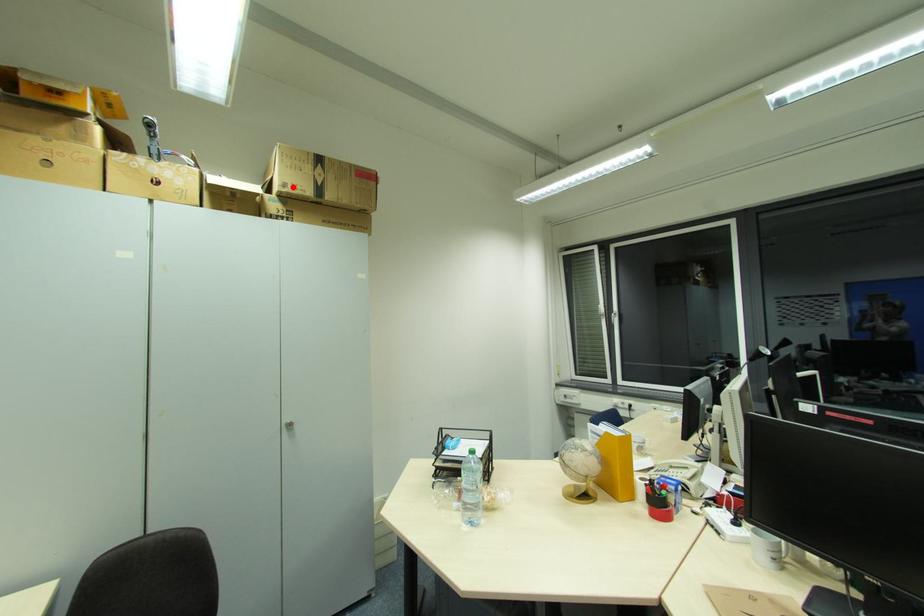
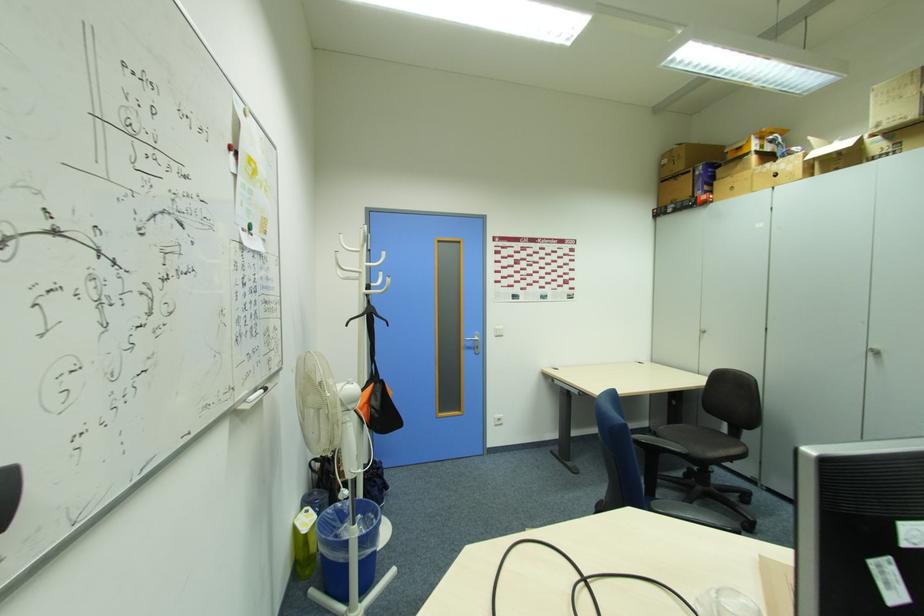
The point at the highlighted location is marked in the first image. Where is the corresponding point in the second image?

(889, 123)